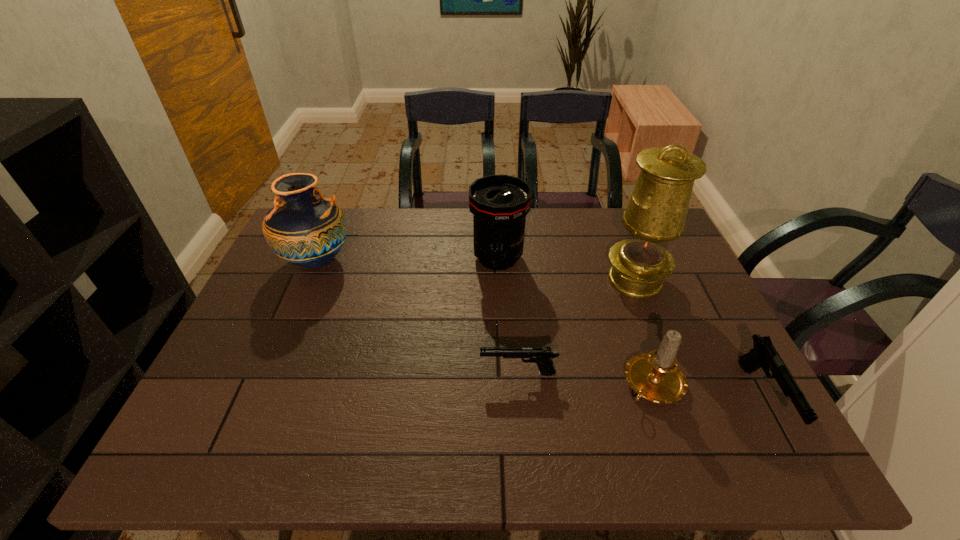
The width and height of the screenshot is (960, 540). I want to click on free space between the left gun and the candle, so click(586, 379).

You are a GUI agent. You are given a task and a screenshot of the screen. Output one action in this format:
    pyautogui.click(x=<x>, y=<y>)
    Task: Click on the free spot between the leftmost object and the tallest object
    The image size is (960, 540).
    Given the screenshot: What is the action you would take?
    pyautogui.click(x=476, y=270)

Where is `vacant area between the third tallest object and the pottery`? The height and width of the screenshot is (540, 960). vacant area between the third tallest object and the pottery is located at coordinates (407, 259).

At what (x,y) coordinates should I click in order to perform the action: click on free space that is in between the fourth tallest object and the third tallest object. Please return your answer as a coordinate pair (x, y). Looking at the image, I should click on (576, 321).

Find the location of a particular element. vacant space in between the shortest object and the candle is located at coordinates (586, 379).

Where is `vacant area that lies between the shorter gun and the pottery`? vacant area that lies between the shorter gun and the pottery is located at coordinates (418, 317).

This screenshot has height=540, width=960. In order to click on empty space between the third shortest object and the telephoto lens in this screenshot , I will do `click(576, 321)`.

The width and height of the screenshot is (960, 540). Identify the location of free area in between the leftmost object and the candle. (485, 322).

Identify which object is the second nearest to the fourth shortest object. Please provide its 2D coordinates. Your answer should be formatted as a tuple, i.e. [(x, y)], where the tuple contains the x and y coordinates of a point satisfying the conditions above.

[(542, 356)]

At what (x,y) coordinates should I click in order to perform the action: click on object that ranks as the fifth closest to the tallest object. Please return your answer as a coordinate pair (x, y). Looking at the image, I should click on (303, 228).